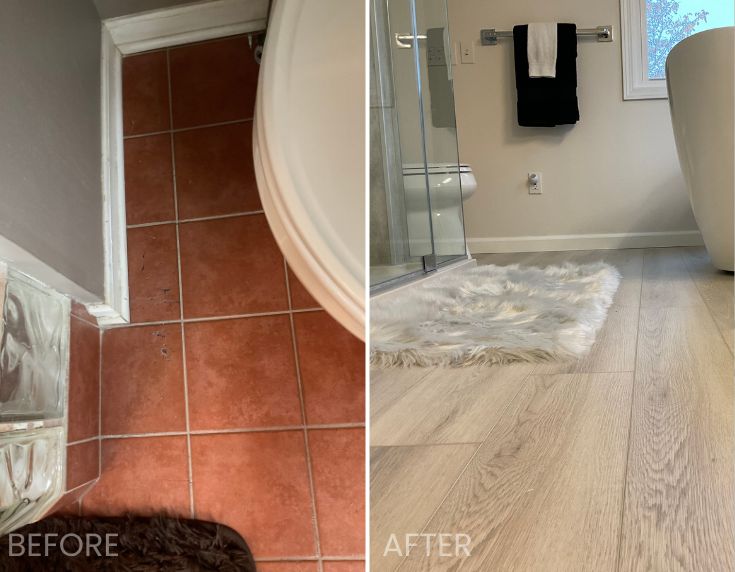
Locate an element on the screen. This screenshot has height=572, width=735. wall is located at coordinates (53, 144), (648, 154).